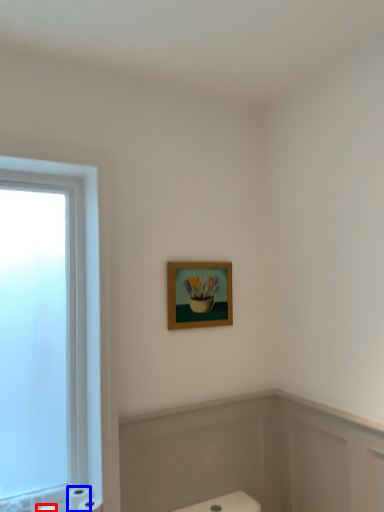
Question: Which of the following is the closest to the observer, toilet paper (highlighted by a red box) or toilet paper (highlighted by a blue box)?

Choices:
 (A) toilet paper
 (B) toilet paper

Answer: (A)